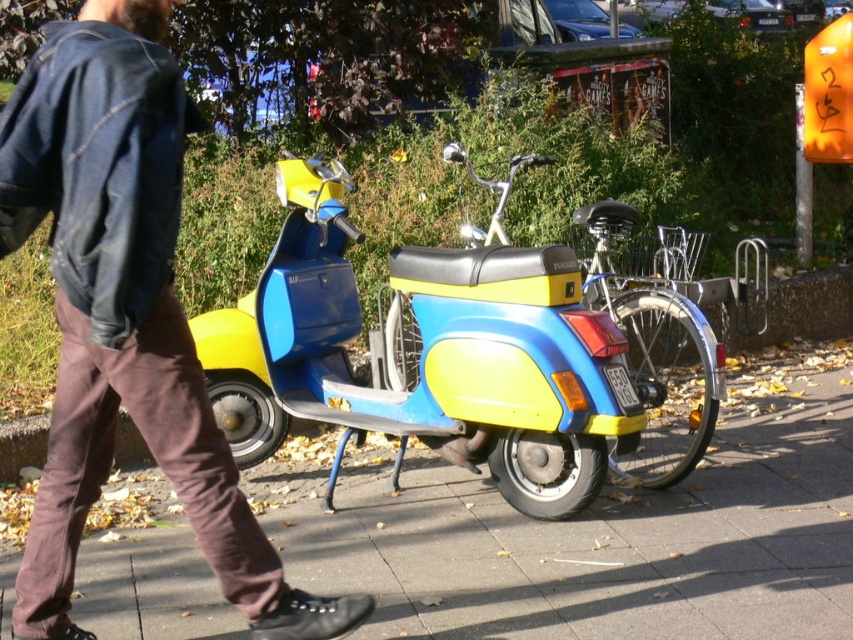
You are a delivery person who needs to quickly reach the scooter parked in the center of the street. You are currently standing near the denim jacket at left. Based on the scene, which direction should you move to reach the yellow matte scooter at center?

The denim jacket at left is positioned on the left side of the yellow matte scooter at center. Therefore, to reach the yellow matte scooter at center, you should move to the right from the denim jacket at left.

You are a delivery person who needs to park your scooter. The yellow matte scooter at center is already parked. Can you park your scooter behind it on the smooth concrete pavement at center?

The smooth concrete pavement at center is in front of the yellow matte scooter at center, so you cannot park behind it there because the pavement is located in front of the scooter, not behind.

You are standing at the center of the image and want to find the denim jacket at left. Based on the coordinates provided, in which direction should you look to locate it?

The denim jacket at left is located at coordinates point (x=125, y=316), which means it is positioned to the left of the center. Therefore, you should look to the left to locate the denim jacket at left.